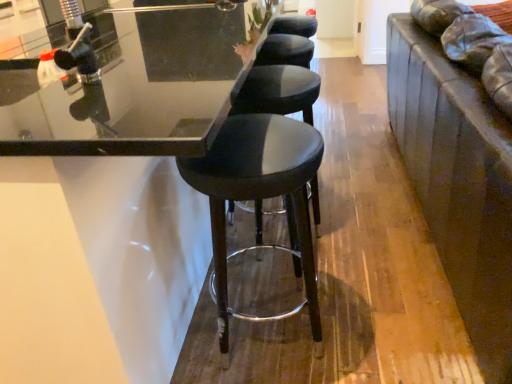
What do you see at coordinates (259, 197) in the screenshot? This screenshot has width=512, height=384. I see `black leather stool at center, placed as the 2th stool when sorted from back to front` at bounding box center [259, 197].

How much space does black leather stool at center, placed as the 2th stool when sorted from back to front, occupy vertically?

It is 71.79 centimeters.

Identify the location of black leather stool at center, placed as the 2th stool when sorted from back to front. This screenshot has width=512, height=384. (259, 197).

What is the approximate width of black leather stool at center, which is the first stool from front to back?

The width of black leather stool at center, which is the first stool from front to back, is 40.40 centimeters.

The height and width of the screenshot is (384, 512). Find the location of `black leather stool at center, which is counted as the second stool, starting from the front`. black leather stool at center, which is counted as the second stool, starting from the front is located at coordinates (278, 91).

The width and height of the screenshot is (512, 384). What do you see at coordinates (278, 91) in the screenshot? I see `black leather stool at center, which is counted as the second stool, starting from the front` at bounding box center [278, 91].

Identify the location of black leather stool at center, which is the first stool from front to back. (259, 197).

Is black leather stool at center, which is the first stool from front to back, at the right side of black leather stool at center, which is the first stool from back to front?

No, black leather stool at center, which is the first stool from front to back, is not to the right of black leather stool at center, which is the first stool from back to front.

Based on the photo, does black leather stool at center, which is the first stool from front to back, lie behind black leather stool at center, which is the first stool from back to front?

No, black leather stool at center, which is the first stool from front to back, is closer to the viewer.

Which is more distant, (x=216, y=206) or (x=298, y=102)?

The point (x=298, y=102) is behind.

From the picture: From the image's perspective, is black leather stool at center, placed as the 2th stool when sorted from back to front, located above or below black leather stool at center, which is the first stool from back to front?

Based on their image positions, black leather stool at center, placed as the 2th stool when sorted from back to front, is located beneath black leather stool at center, which is the first stool from back to front.

From a real-world perspective, which object rests below the other?

Result: black leather stool at center, which is the first stool from back to front.

Does black leather stool at center, placed as the 2th stool when sorted from back to front, have a lesser width compared to black leather stool at center, which is counted as the second stool, starting from the front?

In fact, black leather stool at center, placed as the 2th stool when sorted from back to front, might be wider than black leather stool at center, which is counted as the second stool, starting from the front.

From the picture: Does black leather stool at center, which is the first stool from front to back, have a lesser height compared to black leather stool at center, which is the first stool from back to front?

Indeed, black leather stool at center, which is the first stool from front to back, has a lesser height compared to black leather stool at center, which is the first stool from back to front.

Considering the sizes of black leather stool at center, placed as the 2th stool when sorted from back to front, and black leather stool at center, which is counted as the second stool, starting from the front, in the image, is black leather stool at center, placed as the 2th stool when sorted from back to front, bigger or smaller than black leather stool at center, which is counted as the second stool, starting from the front,?

black leather stool at center, placed as the 2th stool when sorted from back to front, is smaller than black leather stool at center, which is counted as the second stool, starting from the front.

Would you say black leather stool at center, which is the first stool from front to back, is inside or outside black leather stool at center, which is counted as the second stool, starting from the front?

The correct answer is: outside.

Is black leather stool at center, placed as the 2th stool when sorted from back to front, far from black leather stool at center, which is the first stool from back to front?

Actually, black leather stool at center, placed as the 2th stool when sorted from back to front, and black leather stool at center, which is the first stool from back to front, are a little close together.

Could you tell me if black leather stool at center, placed as the 2th stool when sorted from back to front, is turned towards black leather stool at center, which is counted as the second stool, starting from the front?

No, black leather stool at center, placed as the 2th stool when sorted from back to front, is not facing towards black leather stool at center, which is counted as the second stool, starting from the front.

What's the angular difference between black leather stool at center, which is the first stool from front to back, and black leather stool at center, which is counted as the second stool, starting from the front,'s facing directions?

The angle between the facing direction of black leather stool at center, which is the first stool from front to back, and the facing direction of black leather stool at center, which is counted as the second stool, starting from the front, is 2.18e-05 degrees.

I want to click on stool above the black leather stool at center, which is the first stool from back to front (from a real-world perspective), so click(259, 197).

Considering the relative positions of black leather stool at center, which is counted as the second stool, starting from the front, and black leather stool at center, placed as the 2th stool when sorted from back to front, in the image provided, is black leather stool at center, which is counted as the second stool, starting from the front, to the left of black leather stool at center, placed as the 2th stool when sorted from back to front, from the viewer's perspective?

No, black leather stool at center, which is counted as the second stool, starting from the front, is not to the left of black leather stool at center, placed as the 2th stool when sorted from back to front.

Which object is closer to the camera, black leather stool at center, which is the first stool from back to front, or black leather stool at center, placed as the 2th stool when sorted from back to front?

black leather stool at center, placed as the 2th stool when sorted from back to front, is closer to the camera.

Does point (292, 89) lie in front of point (292, 120)?

No, it is behind (292, 120).

From the image's perspective, is black leather stool at center, which is the first stool from back to front, on top of black leather stool at center, which is the first stool from front to back?

Yes.

From a real-world perspective, which object stands above the other?

black leather stool at center, which is the first stool from front to back.

In terms of width, does black leather stool at center, which is counted as the second stool, starting from the front, look wider or thinner when compared to black leather stool at center, which is the first stool from front to back?

Considering their sizes, black leather stool at center, which is counted as the second stool, starting from the front, looks slimmer than black leather stool at center, which is the first stool from front to back.

Is black leather stool at center, which is the first stool from back to front, shorter than black leather stool at center, which is the first stool from front to back?

No, black leather stool at center, which is the first stool from back to front, is not shorter than black leather stool at center, which is the first stool from front to back.

Can you confirm if black leather stool at center, which is counted as the second stool, starting from the front, is bigger than black leather stool at center, which is the first stool from front to back?

Yes, black leather stool at center, which is counted as the second stool, starting from the front, is bigger than black leather stool at center, which is the first stool from front to back.

Is black leather stool at center, placed as the 2th stool when sorted from back to front, surrounded by black leather stool at center, which is the first stool from back to front?

That's incorrect, black leather stool at center, placed as the 2th stool when sorted from back to front, is not inside black leather stool at center, which is the first stool from back to front.

Would you consider black leather stool at center, which is counted as the second stool, starting from the front, to be distant from black leather stool at center, placed as the 2th stool when sorted from back to front?

Actually, black leather stool at center, which is counted as the second stool, starting from the front, and black leather stool at center, placed as the 2th stool when sorted from back to front, are a little close together.

Is black leather stool at center, placed as the 2th stool when sorted from back to front, at the back of black leather stool at center, which is the first stool from back to front?

black leather stool at center, which is the first stool from back to front, does not have its back to black leather stool at center, placed as the 2th stool when sorted from back to front.

I want to click on stool behind the black leather stool at center, placed as the 2th stool when sorted from back to front, so click(x=278, y=91).

Where is `stool lying behind the black leather stool at center, placed as the 2th stool when sorted from back to front`? stool lying behind the black leather stool at center, placed as the 2th stool when sorted from back to front is located at coordinates (278, 91).

Find the location of a particular element. The image size is (512, 384). stool on the left side of black leather stool at center, which is the first stool from back to front is located at coordinates (259, 197).